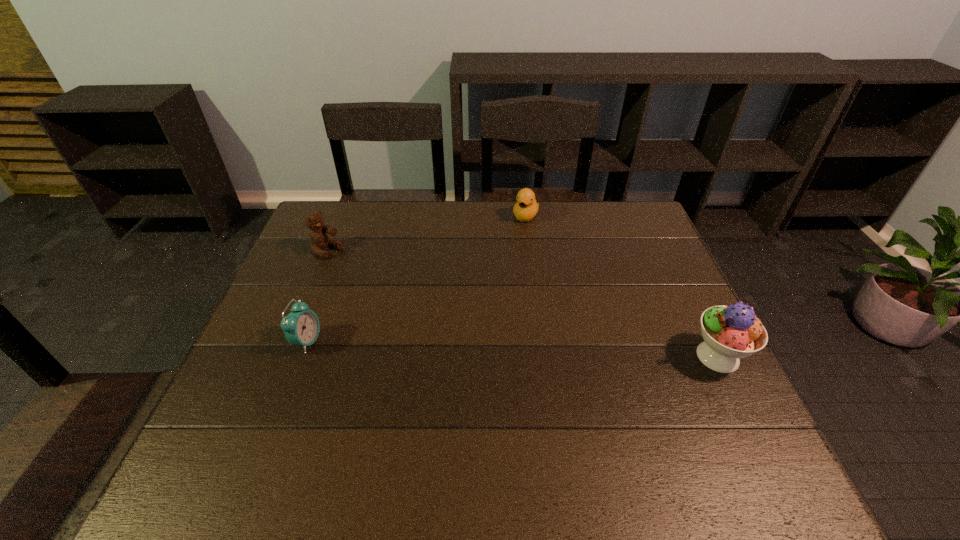
Identify the location of blank space at the far edge. Image resolution: width=960 pixels, height=540 pixels. (433, 237).

I want to click on vacant space at the near edge, so click(297, 415).

Identify the location of vacant space at the left edge of the desktop. (278, 379).

The image size is (960, 540). I want to click on free space at the right edge of the desktop, so tap(664, 382).

Find the location of a particular element. This screenshot has width=960, height=540. free space at the far left corner of the desktop is located at coordinates (326, 218).

The width and height of the screenshot is (960, 540). Find the location of `vacant space at the near left corner of the desktop`. vacant space at the near left corner of the desktop is located at coordinates (260, 404).

Where is `free space at the far right corner of the desktop`? This screenshot has width=960, height=540. free space at the far right corner of the desktop is located at coordinates click(604, 206).

Locate an element on the screen. This screenshot has width=960, height=540. unoccupied position between the alarm clock and the tallest object is located at coordinates (513, 349).

The image size is (960, 540). Find the location of `blank region between the rightmost object and the third nearest object`. blank region between the rightmost object and the third nearest object is located at coordinates (522, 303).

The width and height of the screenshot is (960, 540). Identify the location of vacant space that's between the farthest object and the alarm clock. (417, 279).